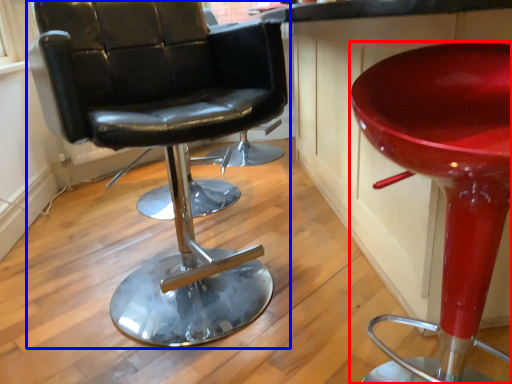
Question: Which object appears closest to the camera in this image, stool (highlighted by a red box) or chair (highlighted by a blue box)?

Choices:
 (A) stool
 (B) chair

Answer: (A)